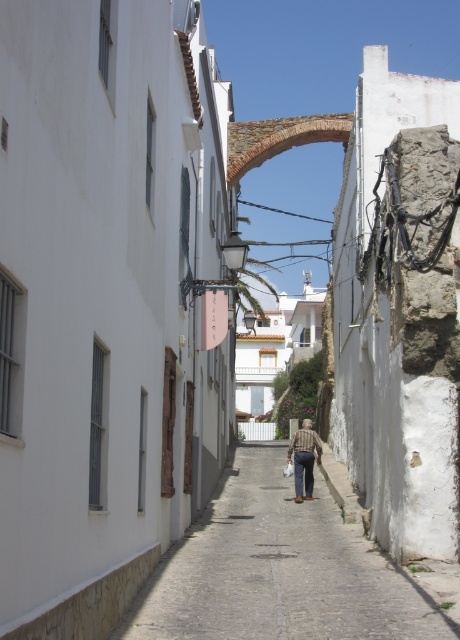
You are a delivery person trying to navigate through the narrow alley. You see the white painted building at center and the brown textured shirt at center. Which object is bigger in size?

The white painted building at center is larger in size than the brown textured shirt at center, so the white painted building at center is bigger.

You are a tourist walking down the narrow alleyway and you notice a cobblestone path at center and a brown textured shirt at center. Which object is located lower in the scene?

The cobblestone path at center is below brown textured shirt at center, so the cobblestone path at center is located lower in the scene.